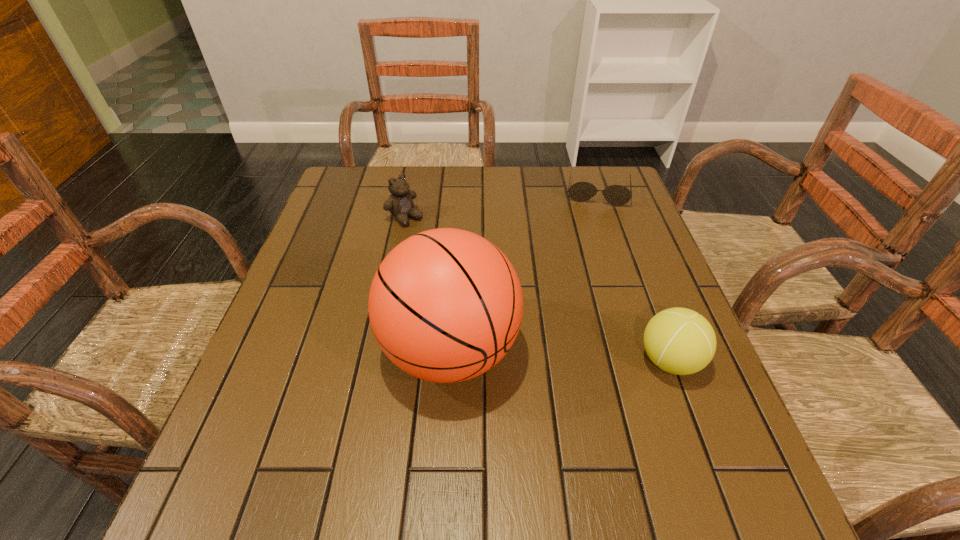
The height and width of the screenshot is (540, 960). What are the coordinates of `basketball` in the screenshot? It's located at 445,305.

The width and height of the screenshot is (960, 540). Identify the location of tennis ball. [680, 341].

Where is `teddy bear`? This screenshot has width=960, height=540. teddy bear is located at coordinates (400, 204).

The image size is (960, 540). Identify the location of the shortest object. [x=617, y=195].

At what (x,y) coordinates should I click in order to perform the action: click on free space located 0.330m on the back of the basketball. Please return your answer as a coordinate pair (x, y). Image resolution: width=960 pixels, height=540 pixels. Looking at the image, I should click on (458, 215).

This screenshot has width=960, height=540. Find the location of `free spot located 0.260m on the left of the tennis ball`. free spot located 0.260m on the left of the tennis ball is located at coordinates (508, 361).

This screenshot has width=960, height=540. What are the coordinates of `vacant space situated 0.290m on the face of the teddy bear` in the screenshot? It's located at (489, 281).

The height and width of the screenshot is (540, 960). In order to click on vacant region located on the face of the teddy bear in this screenshot , I will do `click(492, 283)`.

Find the location of a particular element. This screenshot has width=960, height=540. vacant region located on the face of the teddy bear is located at coordinates (513, 299).

Locate an element on the screen. The image size is (960, 540). free space located on the front-facing side of the shortest object is located at coordinates (594, 218).